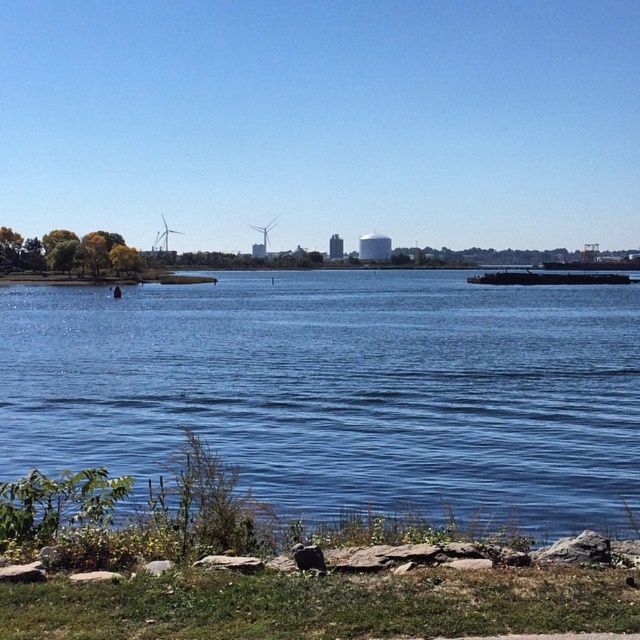
Question: Among these objects, which one is nearest to the camera?

Choices:
 (A) blue liquid water at center
 (B) white matte wind turbine at left
 (C) white matte wind turbine at center

Answer: (A)

Question: Is blue liquid water at center bigger than white matte wind turbine at left?

Choices:
 (A) no
 (B) yes

Answer: (B)

Question: Among these objects, which one is farthest from the camera?

Choices:
 (A) white matte wind turbine at left
 (B) white matte wind turbine at center

Answer: (A)

Question: Which of these objects is positioned closest to the white matte wind turbine at center?

Choices:
 (A) white matte wind turbine at left
 (B) blue liquid water at center

Answer: (A)

Question: Is blue liquid water at center further to the viewer compared to white matte wind turbine at center?

Choices:
 (A) no
 (B) yes

Answer: (A)

Question: Can you confirm if blue liquid water at center is bigger than white matte wind turbine at left?

Choices:
 (A) yes
 (B) no

Answer: (A)